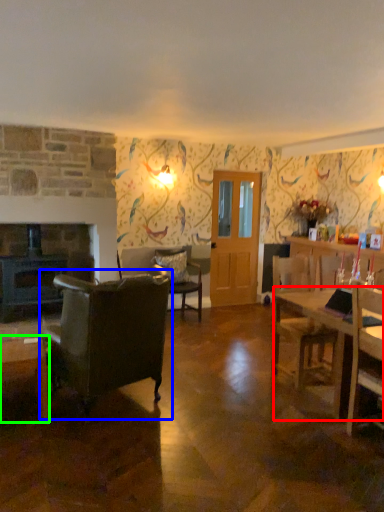
Question: Which object is the closest to the desk (highlighted by a red box)? Choose among these: chair (highlighted by a blue box) or coffee table (highlighted by a green box).

Choices:
 (A) chair
 (B) coffee table

Answer: (A)